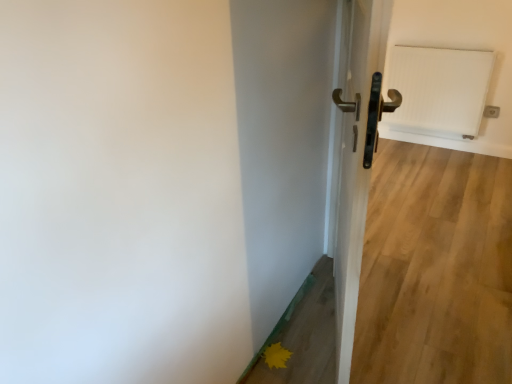
Identify the location of vacant space in between metallic gold door handle at center and yellow matte flower at lower right. The width and height of the screenshot is (512, 384). (301, 329).